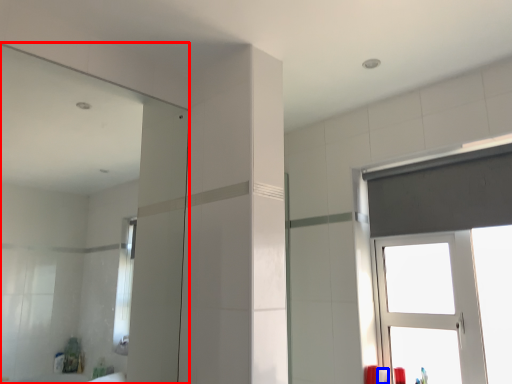
Question: Which point is closer to the camera, mirror (highlighted by a red box) or toiletry (highlighted by a blue box)?

Choices:
 (A) mirror
 (B) toiletry

Answer: (A)